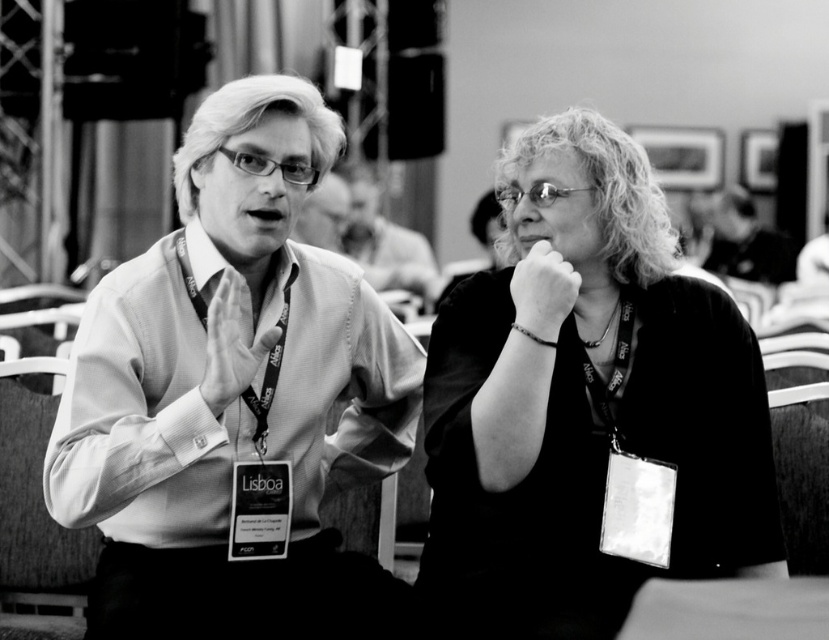
You are a photographer trying to capture a closeup of the matte black shirt at center and the matte white hand at center in this black and white photo. Which object should you focus on to ensure it fits entirely within the frame if your camera can only accommodate one object at a time?

The matte black shirt at center might be wider than the matte white hand at center, so focusing on the matte black shirt at center would be better to ensure it fits within the frame.